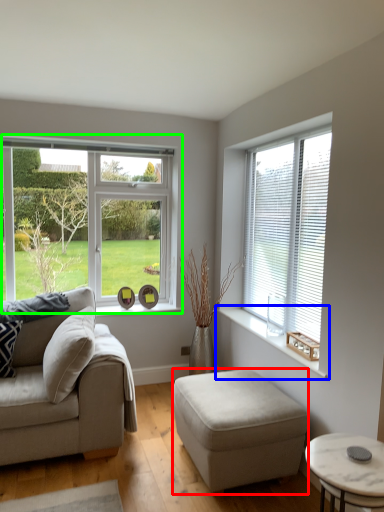
Question: Which object is positioned farthest from stool (highlighted by a red box)? Select from window sill (highlighted by a blue box) and window (highlighted by a green box).

Choices:
 (A) window sill
 (B) window

Answer: (B)